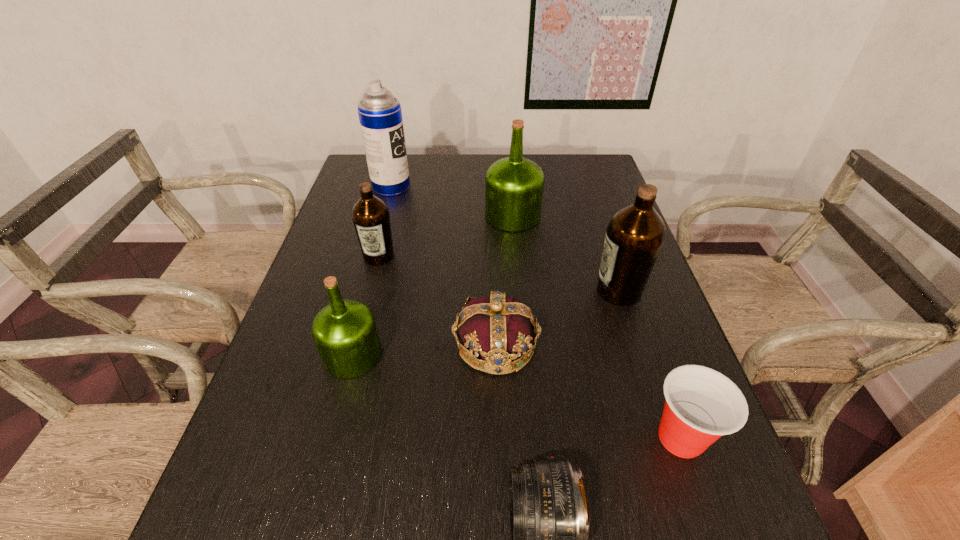
Select which object is the closest to the second nearest object. Please provide its 2D coordinates. Your answer should be formatted as a tuple, i.e. [(x, y)], where the tuple contains the x and y coordinates of a point satisfying the conditions above.

[(548, 513)]

Find the location of a particular element. object that ranks as the seventh closest to the telephoto lens is located at coordinates (380, 115).

Identify the location of olive oil that stands as the closest to the bigger green olive oil. The height and width of the screenshot is (540, 960). (634, 237).

Locate which olive oil ranks second in proximity to the purple crown. Please provide its 2D coordinates. Your answer should be formatted as a tuple, i.e. [(x, y)], where the tuple contains the x and y coordinates of a point satisfying the conditions above.

[(634, 237)]

Locate an element on the screen. free space in the image that satisfies the following two spatial constraints: 1. on the label of the smaller brown olive oil; 2. on the left side of the crown is located at coordinates (356, 345).

Find the location of a particular element. vacant region that satisfies the following two spatial constraints: 1. on the front side of the cup; 2. on the left side of the nearer green olive oil is located at coordinates (331, 438).

This screenshot has height=540, width=960. Find the location of `free space that satisfies the following two spatial constraints: 1. on the label of the purple crown; 2. on the left side of the third nearest olive oil`. free space that satisfies the following two spatial constraints: 1. on the label of the purple crown; 2. on the left side of the third nearest olive oil is located at coordinates (356, 345).

Where is `vacant space that satisfies the following two spatial constraints: 1. on the label of the rightmost olive oil; 2. on the front side of the nearer green olive oil`? vacant space that satisfies the following two spatial constraints: 1. on the label of the rightmost olive oil; 2. on the front side of the nearer green olive oil is located at coordinates (639, 355).